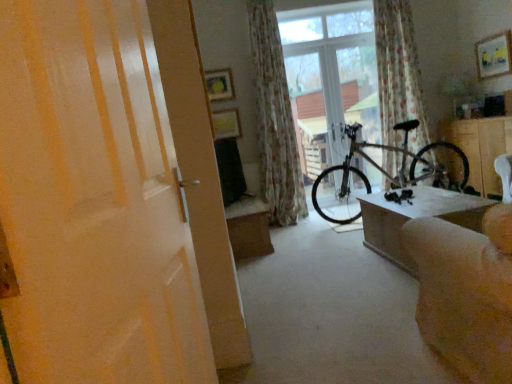
Question: Considering the relative sizes of matte yellow picture frame at upper center, which appears as the second picture frame when viewed from the right, and wooden table at center, marked as the first table in a back-to-front arrangement, in the image provided, is matte yellow picture frame at upper center, which appears as the second picture frame when viewed from the right, wider than wooden table at center, marked as the first table in a back-to-front arrangement,?

Choices:
 (A) no
 (B) yes

Answer: (A)

Question: Is matte yellow picture frame at upper center, the third picture frame from the front, further to the viewer compared to wooden table at center, placed as the second table when sorted from front to back?

Choices:
 (A) no
 (B) yes

Answer: (B)

Question: Is matte yellow picture frame at upper center, the first picture frame positioned from the back, not within wooden table at center, the second table positioned from the right?

Choices:
 (A) no
 (B) yes

Answer: (B)

Question: Is matte yellow picture frame at upper center, which appears as the second picture frame when viewed from the right, positioned far away from wooden table at center, marked as the first table in a back-to-front arrangement?

Choices:
 (A) yes
 (B) no

Answer: (A)

Question: Considering the relative positions of matte yellow picture frame at upper center, which ranks as the first picture frame in bottom-to-top order, and wooden table at center, the second table positioned from the right, in the image provided, is matte yellow picture frame at upper center, which ranks as the first picture frame in bottom-to-top order, to the right of wooden table at center, the second table positioned from the right, from the viewer's perspective?

Choices:
 (A) yes
 (B) no

Answer: (B)

Question: Relative to floral fabric curtain at center, acting as the second curtain starting from the left, is wooden painted picture frame at upper right, the 3th picture frame positioned from the back, in front or behind?

Choices:
 (A) front
 (B) behind

Answer: (A)

Question: From a real-world perspective, is wooden painted picture frame at upper right, the 3th picture frame positioned from the back, positioned above or below floral fabric curtain at center, which is the first curtain from right to left?

Choices:
 (A) above
 (B) below

Answer: (A)

Question: In terms of size, does wooden painted picture frame at upper right, the first picture frame viewed from the right, appear bigger or smaller than floral fabric curtain at center, which is the first curtain from right to left?

Choices:
 (A) small
 (B) big

Answer: (A)

Question: From the image's perspective, is wooden painted picture frame at upper right, marked as the 3th picture frame in a left-to-right arrangement, located above or below floral fabric curtain at center, which is the first curtain from right to left?

Choices:
 (A) below
 (B) above

Answer: (B)

Question: Considering the positions of matte yellow picture frame at upper center, which ranks as the first picture frame in bottom-to-top order, and wooden cabinet at right in the image, is matte yellow picture frame at upper center, which ranks as the first picture frame in bottom-to-top order, wider or thinner than wooden cabinet at right?

Choices:
 (A) thin
 (B) wide

Answer: (A)

Question: From the image's perspective, is matte yellow picture frame at upper center, the first picture frame positioned from the back, located above or below wooden cabinet at right?

Choices:
 (A) above
 (B) below

Answer: (A)

Question: Based on their positions, is matte yellow picture frame at upper center, the first picture frame positioned from the back, located to the left or right of wooden cabinet at right?

Choices:
 (A) right
 (B) left

Answer: (B)

Question: From a real-world perspective, is matte yellow picture frame at upper center, which appears as the 2th picture frame when viewed from the left, positioned above or below wooden cabinet at right?

Choices:
 (A) below
 (B) above

Answer: (B)

Question: Choose the correct answer: Is wooden table at center, the first table from the left, inside wooden cabinet at right or outside it?

Choices:
 (A) inside
 (B) outside

Answer: (B)

Question: Considering the relative positions of wooden table at center, placed as the second table when sorted from front to back, and wooden cabinet at right in the image provided, is wooden table at center, placed as the second table when sorted from front to back, to the left or to the right of wooden cabinet at right?

Choices:
 (A) left
 (B) right

Answer: (A)